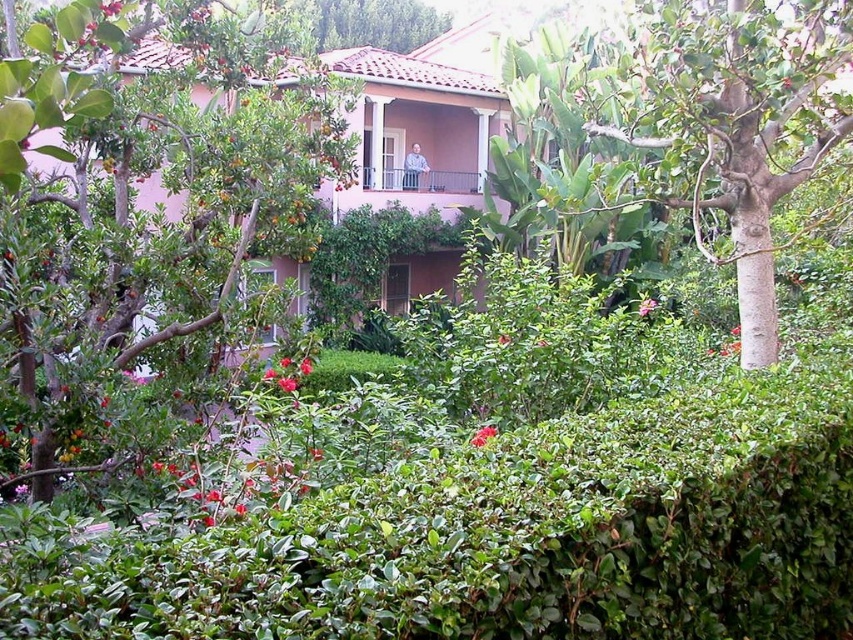
Is vivid red petals at center to the right of smooth pink flower at center from the viewer's perspective?

Incorrect, vivid red petals at center is not on the right side of smooth pink flower at center.

Between point (270, 376) and point (509, 342), which one is positioned in front?

Point (270, 376)

Is point (276, 372) farther from camera compared to point (500, 337)?

That is False.

Where is `vivid red petals at center`? The width and height of the screenshot is (853, 640). vivid red petals at center is located at coordinates (270, 372).

Does red matte flower at center appear on the right side of vivid red petals at center?

Indeed, red matte flower at center is positioned on the right side of vivid red petals at center.

Is point (306, 364) more distant than point (271, 372)?

Yes, point (306, 364) is farther from viewer.

The image size is (853, 640). In order to click on red matte flower at center in this screenshot , I will do `click(305, 365)`.

Which is behind, point (486, 436) or point (288, 360)?

Positioned behind is point (288, 360).

Is point (482, 438) in front of point (289, 358)?

That is True.

Image resolution: width=853 pixels, height=640 pixels. I want to click on green leafy bush at center, so click(x=482, y=435).